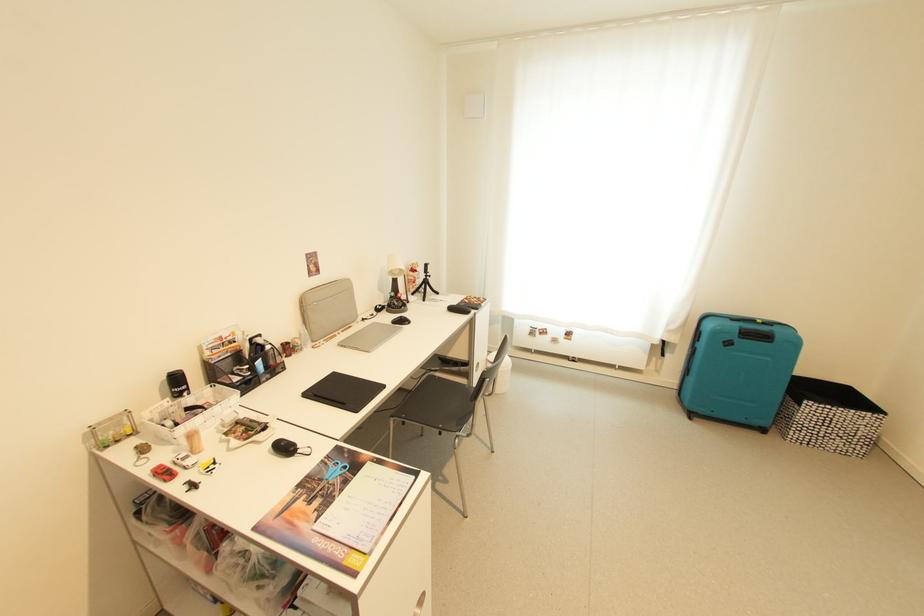
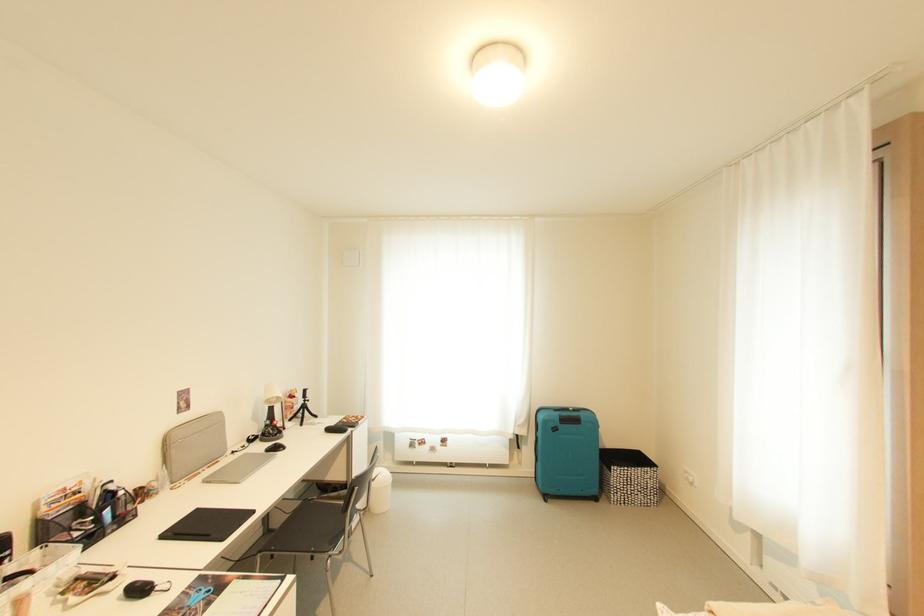
Where in the second image is the point corresponding to (x=419, y=284) from the first image?

(297, 410)